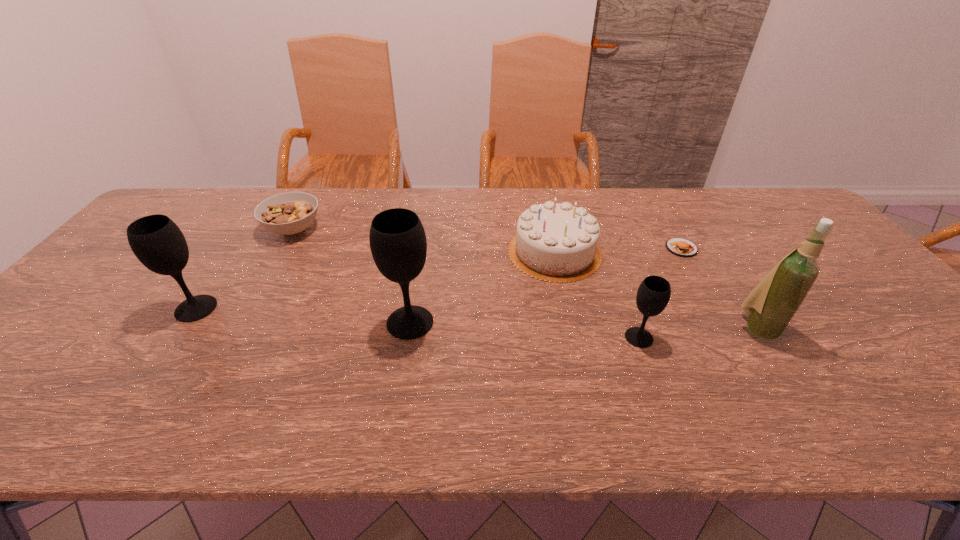
Identify the location of free space for a new wineglass on the right. Image resolution: width=960 pixels, height=540 pixels. (x=884, y=354).